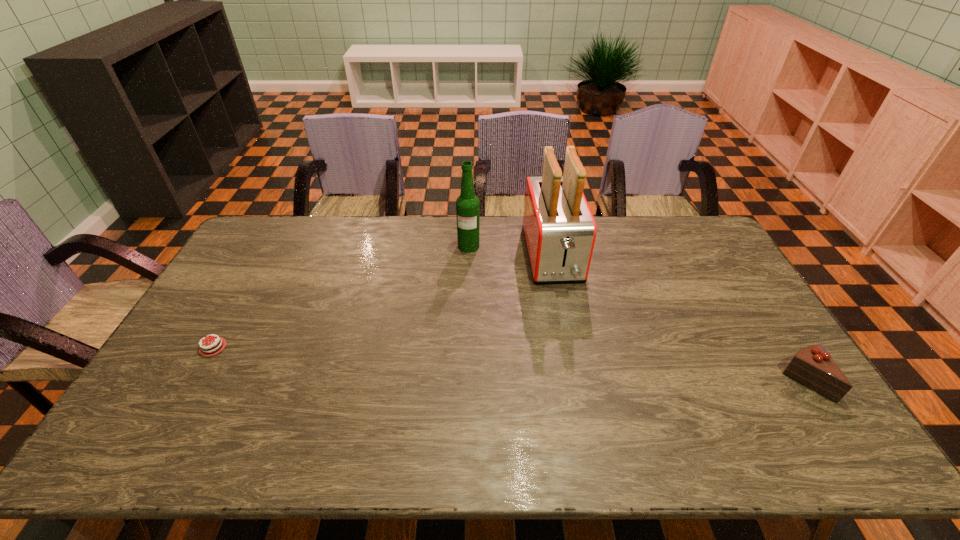
The image size is (960, 540). In order to click on free spot on the desktop that is between the leftmost object and the second shortest object and is positioned on the label of the beer bottle in this screenshot , I will do `click(455, 361)`.

This screenshot has height=540, width=960. Find the location of `free space on the desktop that is between the shortest object and the taller chocolate cake and is positioned on the front-facing side of the toaster`. free space on the desktop that is between the shortest object and the taller chocolate cake and is positioned on the front-facing side of the toaster is located at coordinates (583, 369).